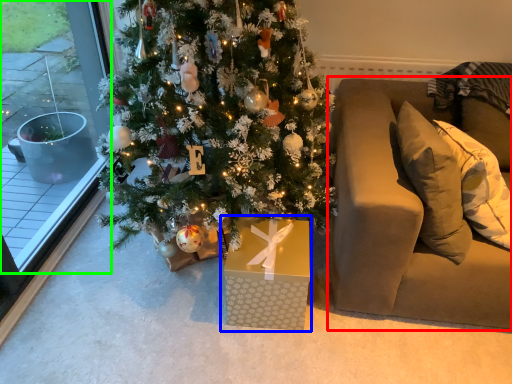
Question: Which object is the farthest from studio couch (highlighted by a red box)? Choose among these: gift box (highlighted by a blue box) or window (highlighted by a green box).

Choices:
 (A) gift box
 (B) window

Answer: (B)